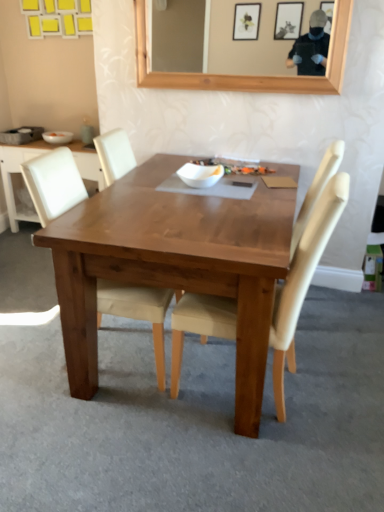
Describe the element at coordinates (200, 175) in the screenshot. I see `white matte bowl at center, acting as the 1th bowl starting from the right` at that location.

What is the approximate width of white matte bowl at upper left, the second bowl positioned from the bottom?

white matte bowl at upper left, the second bowl positioned from the bottom, is 5.25 inches in width.

Locate an element on the screen. Image resolution: width=384 pixels, height=512 pixels. white matte bowl at upper left, acting as the 1th bowl starting from the back is located at coordinates (57, 137).

The width and height of the screenshot is (384, 512). What do you see at coordinates (53, 183) in the screenshot?
I see `light beige fabric chair at center, which appears as the 1th chair when viewed from the left` at bounding box center [53, 183].

In order to click on white matte bowl at center, which appears as the first bowl when ordered from the bottom in this screenshot , I will do `click(200, 175)`.

Is matte gray coffee cup at upper left placed right next to white matte bowl at center, acting as the second bowl starting from the left?

No, matte gray coffee cup at upper left is not in contact with white matte bowl at center, acting as the second bowl starting from the left.

From the image's perspective, who appears lower, matte gray coffee cup at upper left or white matte bowl at center, placed as the 1th bowl when sorted from front to back?

From the image's view, white matte bowl at center, placed as the 1th bowl when sorted from front to back, is below.

This screenshot has height=512, width=384. Identify the location of bowl above the matte gray coffee cup at upper left (from a real-world perspective). (200, 175).

Would you say matte gray coffee cup at upper left is inside or outside white matte bowl at center, acting as the 1th bowl starting from the right?

matte gray coffee cup at upper left exists outside the volume of white matte bowl at center, acting as the 1th bowl starting from the right.

From the picture: Relative to beige fabric chair at center, acting as the second chair starting from the left, is wooden table at center in front or behind?

Clearly, wooden table at center is behind beige fabric chair at center, acting as the second chair starting from the left.

Considering the relative sizes of wooden table at center and beige fabric chair at center, the 1th chair in the right-to-left sequence, in the image provided, is wooden table at center smaller than beige fabric chair at center, the 1th chair in the right-to-left sequence,?

No.

Is wooden table at center spatially inside beige fabric chair at center, acting as the second chair starting from the left, or outside of it?

wooden table at center is located beyond the bounds of beige fabric chair at center, acting as the second chair starting from the left.

Is point (62, 265) less distant than point (178, 385)?

Yes, it is in front of point (178, 385).

Can you confirm if matte gray coffee cup at upper left is wider than wooden table at center?

In fact, matte gray coffee cup at upper left might be narrower than wooden table at center.

Is matte gray coffee cup at upper left surrounding wooden table at center?

No, matte gray coffee cup at upper left does not contain wooden table at center.

Is matte gray coffee cup at upper left further to camera compared to wooden table at center?

Yes.

Could you tell me if matte gray coffee cup at upper left is turned towards wooden table at center?

No, matte gray coffee cup at upper left does not turn towards wooden table at center.

Based on the photo, from the image's perspective, would you say white matte bowl at upper left, the second bowl positioned from the bottom, is shown under beige fabric chair at center, acting as the second chair starting from the left?

Incorrect, from the image's perspective, white matte bowl at upper left, the second bowl positioned from the bottom, is higher than beige fabric chair at center, acting as the second chair starting from the left.

Is white matte bowl at upper left, the second bowl when ordered from right to left, located outside beige fabric chair at center, the 1th chair in the right-to-left sequence?

Absolutely, white matte bowl at upper left, the second bowl when ordered from right to left, is external to beige fabric chair at center, the 1th chair in the right-to-left sequence.

Is white matte bowl at upper left, acting as the 1th bowl starting from the back, wider than beige fabric chair at center, acting as the second chair starting from the left?

No, white matte bowl at upper left, acting as the 1th bowl starting from the back, is not wider than beige fabric chair at center, acting as the second chair starting from the left.

Which object is closer to the camera taking this photo, light beige fabric chair at center, which is counted as the 2th chair, starting from the right, or white matte bowl at center, which is the 2th bowl in back-to-front order?

light beige fabric chair at center, which is counted as the 2th chair, starting from the right, is closer to the camera.

Considering the sizes of objects light beige fabric chair at center, which is counted as the 2th chair, starting from the right, and white matte bowl at center, placed as the 1th bowl when sorted from front to back, in the image provided, who is bigger, light beige fabric chair at center, which is counted as the 2th chair, starting from the right, or white matte bowl at center, placed as the 1th bowl when sorted from front to back,?

light beige fabric chair at center, which is counted as the 2th chair, starting from the right, is bigger.

Are light beige fabric chair at center, which is counted as the 2th chair, starting from the right, and white matte bowl at center, which appears as the first bowl when ordered from the bottom, making contact?

light beige fabric chair at center, which is counted as the 2th chair, starting from the right, and white matte bowl at center, which appears as the first bowl when ordered from the bottom, are clearly separated.

Consider the image. Who is shorter, light beige fabric chair at center, which appears as the 1th chair when viewed from the left, or white matte bowl at center, which is the 2th bowl in back-to-front order?

Standing shorter between the two is white matte bowl at center, which is the 2th bowl in back-to-front order.

Considering the sizes of matte gray coffee cup at upper left and beige fabric chair at center, acting as the second chair starting from the left, in the image, is matte gray coffee cup at upper left taller or shorter than beige fabric chair at center, acting as the second chair starting from the left,?

Clearly, matte gray coffee cup at upper left is shorter compared to beige fabric chair at center, acting as the second chair starting from the left.

Is matte gray coffee cup at upper left not close to beige fabric chair at center, acting as the second chair starting from the left?

Yes.

Which of these two, matte gray coffee cup at upper left or beige fabric chair at center, the 1th chair in the right-to-left sequence, is smaller?

matte gray coffee cup at upper left.

In the scene shown: Is matte gray coffee cup at upper left positioned with its back to beige fabric chair at center, the 1th chair in the right-to-left sequence?

No.

How different are the orientations of beige fabric chair at center, acting as the second chair starting from the left, and wooden table at center in degrees?

They differ by 96.1 degrees in their facing directions.

Measure the distance from beige fabric chair at center, the 1th chair in the right-to-left sequence, to wooden table at center.

A distance of 10.59 inches exists between beige fabric chair at center, the 1th chair in the right-to-left sequence, and wooden table at center.

From a real-world perspective, which object rests below the other?

From a 3D spatial view, wooden table at center is below.

Considering the points (176, 375) and (117, 254), which point is in front, point (176, 375) or point (117, 254)?

The point (117, 254) is closer to the camera.

This screenshot has height=512, width=384. Find the location of `coffee cup below the white matte bowl at center, which is the 2th bowl in back-to-front order (from a real-world perspective)`. coffee cup below the white matte bowl at center, which is the 2th bowl in back-to-front order (from a real-world perspective) is located at coordinates (87, 131).

You are a GUI agent. You are given a task and a screenshot of the screen. Output one action in this format:
    pyautogui.click(x=<x>, y=<y>)
    Task: Click on the kitchen & dining room table behind the beige fabric chair at center, acting as the second chair starting from the left
    This screenshot has height=512, width=384.
    Given the screenshot: What is the action you would take?
    pyautogui.click(x=173, y=265)

Considering their positions, is light beige fabric chair at center, which is counted as the 2th chair, starting from the right, positioned closer to wooden table at center than white matte bowl at center, arranged as the second bowl when viewed from the top?

light beige fabric chair at center, which is counted as the 2th chair, starting from the right, is positioned closer to the anchor wooden table at center.

Based on their spatial positions, is white matte bowl at upper left, the second bowl when ordered from right to left, or beige fabric chair at center, acting as the second chair starting from the left, closer to wooden table at center?

beige fabric chair at center, acting as the second chair starting from the left, lies closer to wooden table at center than the other object.

Based on their spatial positions, is light beige fabric chair at center, which is counted as the 2th chair, starting from the right, or wooden table at center further from white matte bowl at upper left, which ranks as the 1th bowl in left-to-right order?

Based on the image, wooden table at center appears to be further to white matte bowl at upper left, which ranks as the 1th bowl in left-to-right order.

Considering their positions, is light beige fabric chair at center, which appears as the 1th chair when viewed from the left, positioned further to wooden table at center than matte gray coffee cup at upper left?

The object further to wooden table at center is matte gray coffee cup at upper left.

Based on their spatial positions, is white matte bowl at upper left, the second bowl when ordered from right to left, or light beige fabric chair at center, which appears as the 1th chair when viewed from the left, closer to matte gray coffee cup at upper left?

Among the two, white matte bowl at upper left, the second bowl when ordered from right to left, is located nearer to matte gray coffee cup at upper left.

Estimate the real-world distances between objects in this image. Which object is closer to beige fabric chair at center, acting as the second chair starting from the left, light beige fabric chair at center, which appears as the 1th chair when viewed from the left, or wooden table at center?

The object closer to beige fabric chair at center, acting as the second chair starting from the left, is wooden table at center.

Estimate the real-world distances between objects in this image. Which object is closer to light beige fabric chair at center, which appears as the 1th chair when viewed from the left, wooden table at center or white matte bowl at center, placed as the 1th bowl when sorted from front to back?

The object closer to light beige fabric chair at center, which appears as the 1th chair when viewed from the left, is wooden table at center.

Looking at the image, which one is located closer to white matte bowl at center, which is the 2th bowl in back-to-front order, light beige fabric chair at center, which appears as the 1th chair when viewed from the left, or white matte bowl at upper left, which is the first bowl in top-to-bottom order?

Among the two, light beige fabric chair at center, which appears as the 1th chair when viewed from the left, is located nearer to white matte bowl at center, which is the 2th bowl in back-to-front order.

Identify the location of kitchen & dining room table between beige fabric chair at center, acting as the second chair starting from the left, and white matte bowl at center, arranged as the second bowl when viewed from the top, from front to back. The image size is (384, 512). (173, 265).

Where is `bowl between beige fabric chair at center, acting as the second chair starting from the left, and white matte bowl at upper left, which is the second bowl in front-to-back order, along the z-axis`? bowl between beige fabric chair at center, acting as the second chair starting from the left, and white matte bowl at upper left, which is the second bowl in front-to-back order, along the z-axis is located at coordinates (200, 175).

This screenshot has width=384, height=512. In order to click on kitchen & dining room table between beige fabric chair at center, the 1th chair in the right-to-left sequence, and white matte bowl at upper left, the second bowl positioned from the bottom, along the z-axis in this screenshot , I will do `click(173, 265)`.

The width and height of the screenshot is (384, 512). I want to click on chair between wooden table at center and matte gray coffee cup at upper left from front to back, so click(x=53, y=183).